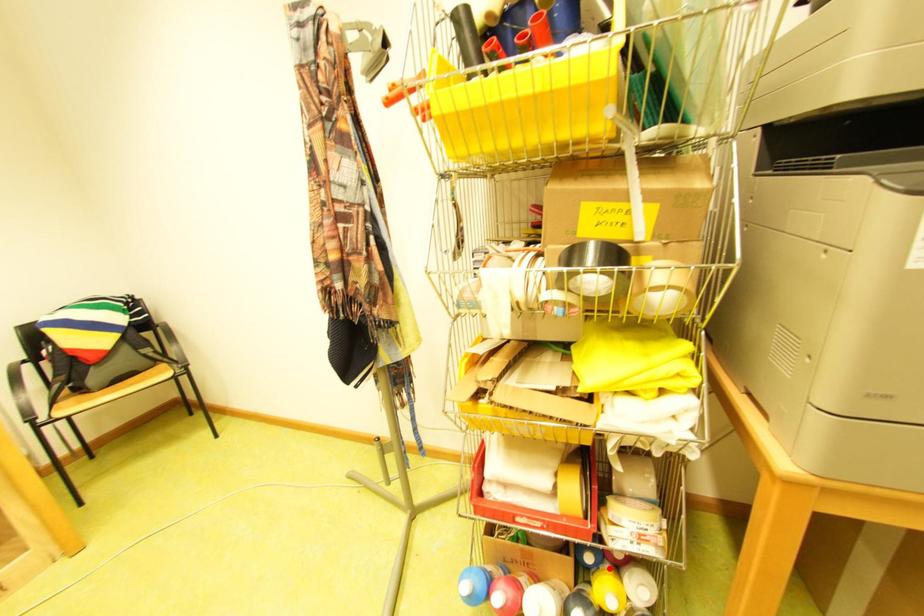
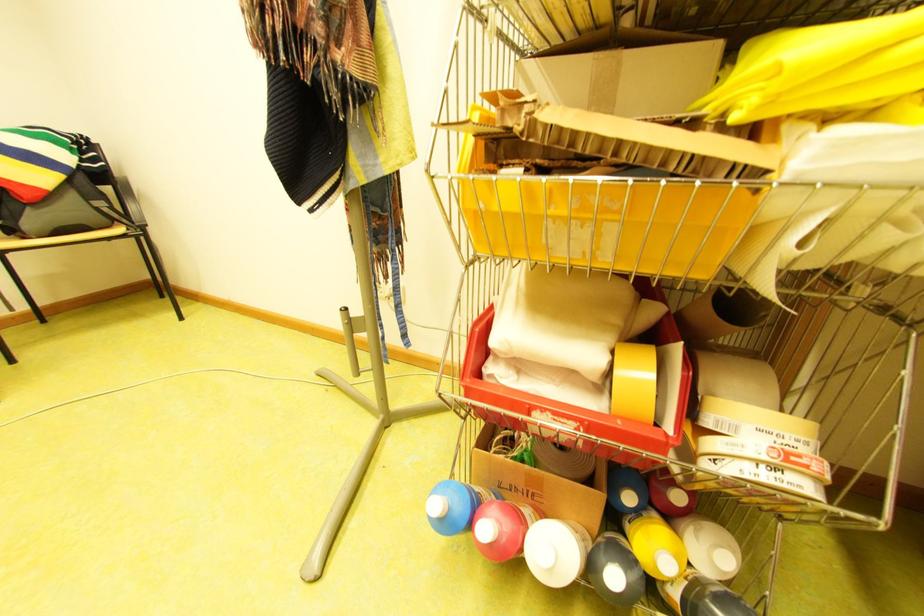
Locate, in the second image, the point that corresponds to the highlighted location in the first image.

(649, 513)